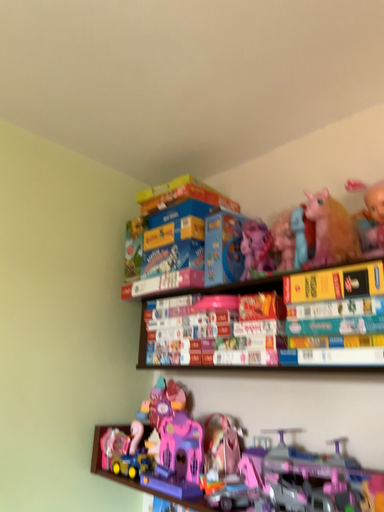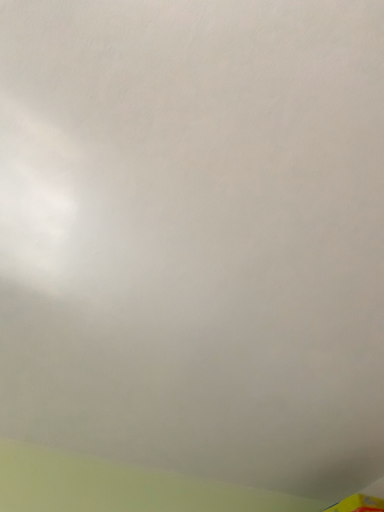
Question: Which way did the camera rotate in the video?

Choices:
 (A) rotated upward
 (B) rotated downward

Answer: (A)